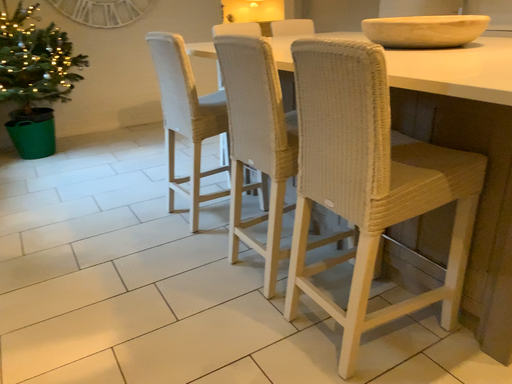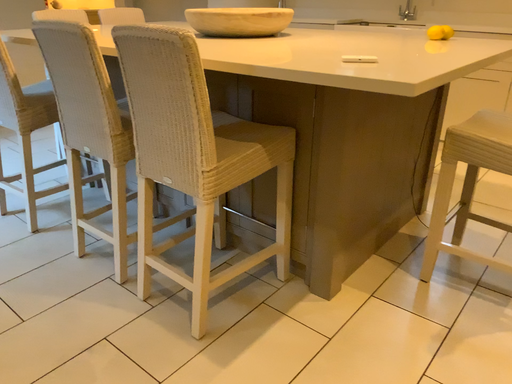
Question: Which way did the camera rotate in the video?

Choices:
 (A) rotated right
 (B) rotated left

Answer: (A)